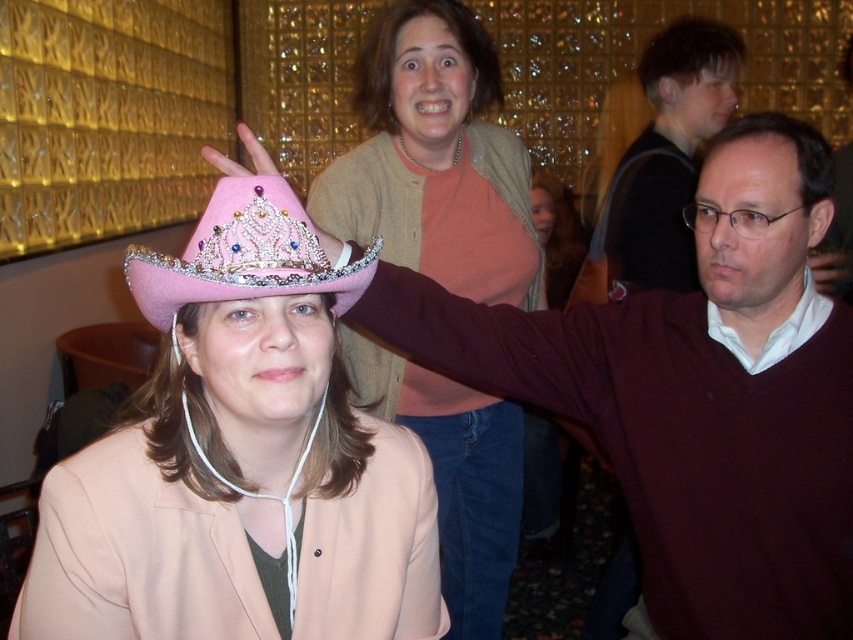
Question: Which of these objects is positioned closest to the pink felt sombrero at center?

Choices:
 (A) pink fabric tiara at upper center
 (B) pink felt hat at lower left
 (C) matte pink sweater at center

Answer: (B)

Question: Which object is closer to the camera taking this photo?

Choices:
 (A) pink felt hat at lower left
 (B) pink felt sombrero at center
 (C) matte pink sweater at center

Answer: (B)

Question: Among these points, which one is farthest from the camera?

Choices:
 (A) (227, 602)
 (B) (451, 464)
 (C) (195, 236)
 (D) (811, 554)

Answer: (B)

Question: Is matte pink sweater at center closer to camera compared to pink fabric tiara at upper center?

Choices:
 (A) no
 (B) yes

Answer: (B)

Question: Can you confirm if pink felt hat at lower left is positioned above pink fabric tiara at upper center?

Choices:
 (A) yes
 (B) no

Answer: (B)

Question: Is pink felt hat at lower left smaller than matte pink sweater at center?

Choices:
 (A) no
 (B) yes

Answer: (B)